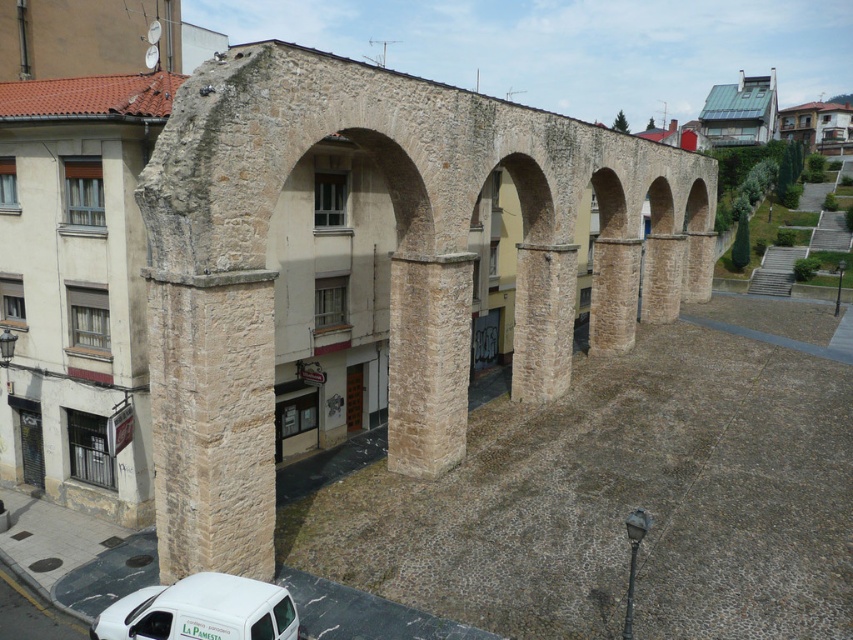
Question: Which point is closer to the camera?

Choices:
 (A) white matte van at lower left
 (B) natural stone viaduct at center

Answer: (A)

Question: Does natural stone viaduct at center appear on the left side of white matte van at lower left?

Choices:
 (A) no
 (B) yes

Answer: (A)

Question: Which object appears closest to the camera in this image?

Choices:
 (A) natural stone viaduct at center
 (B) white matte van at lower left

Answer: (B)

Question: Does natural stone viaduct at center appear on the right side of white matte van at lower left?

Choices:
 (A) no
 (B) yes

Answer: (B)

Question: Does natural stone viaduct at center lie behind white matte van at lower left?

Choices:
 (A) no
 (B) yes

Answer: (B)